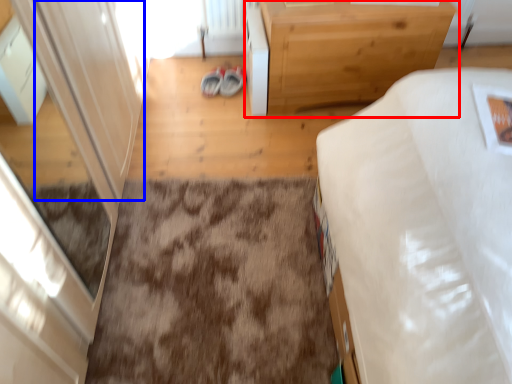
Question: Which object is closer to the camera taking this photo, table (highlighted by a red box) or screen door (highlighted by a blue box)?

Choices:
 (A) table
 (B) screen door

Answer: (B)